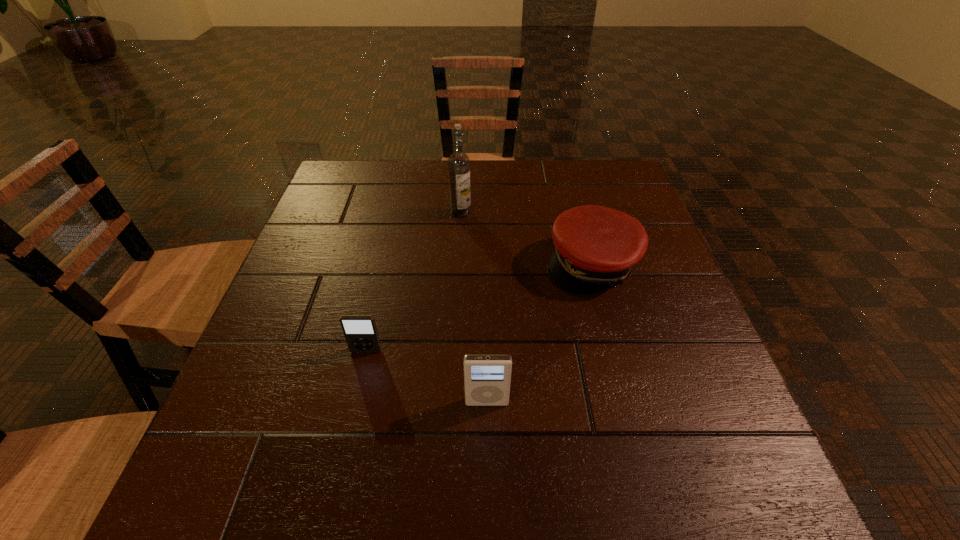
The image size is (960, 540). In order to click on vacant position located on the front-facing side of the cap in this screenshot , I will do `click(649, 477)`.

In order to click on blank area located 0.210m on the front-facing side of the leftmost object in this screenshot , I will do `click(340, 468)`.

You are a GUI agent. You are given a task and a screenshot of the screen. Output one action in this format:
    pyautogui.click(x=<x>, y=<y>)
    Task: Click on the object at the far edge
    The width and height of the screenshot is (960, 540).
    Given the screenshot: What is the action you would take?
    pyautogui.click(x=459, y=163)

I want to click on object at the right edge, so click(595, 247).

Locate an element on the screen. This screenshot has width=960, height=540. vacant space at the far edge is located at coordinates (540, 183).

The width and height of the screenshot is (960, 540). In the image, there is a desktop. In order to click on vacant space at the near edge in this screenshot , I will do `click(464, 477)`.

The height and width of the screenshot is (540, 960). Find the location of `vacant point at the left edge`. vacant point at the left edge is located at coordinates (317, 221).

You are a GUI agent. You are given a task and a screenshot of the screen. Output one action in this format:
    pyautogui.click(x=<x>, y=<y>)
    Task: Click on the vacant region at the right edge
    Image resolution: width=960 pixels, height=540 pixels.
    Given the screenshot: What is the action you would take?
    pyautogui.click(x=616, y=301)

Find the location of a particular element. vacant area at the far right corner of the desktop is located at coordinates (607, 188).

The image size is (960, 540). In order to click on vacant space at the near right corner of the desktop in this screenshot , I will do `click(735, 472)`.